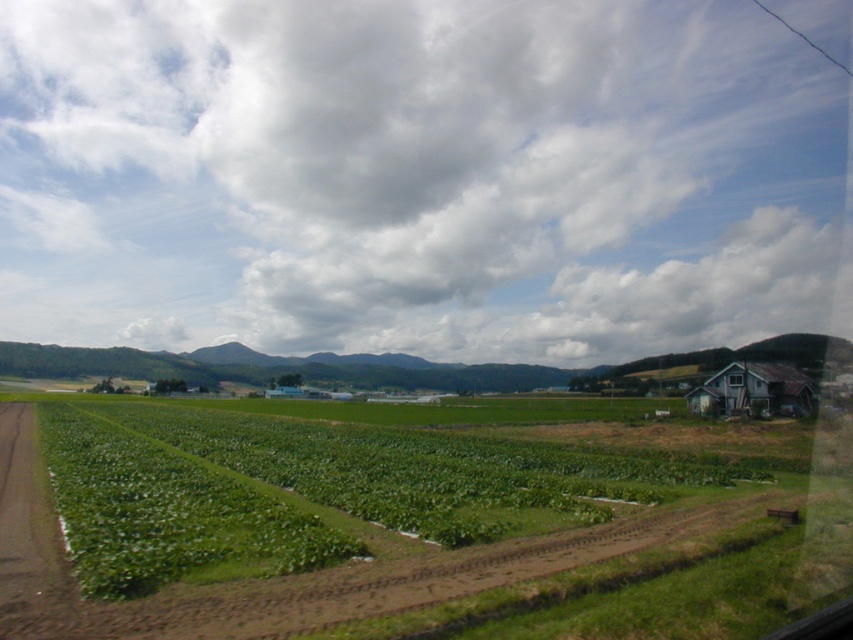
Question: Is green leafy field at center above rusty wood house at right?

Choices:
 (A) no
 (B) yes

Answer: (A)

Question: Which of the following is the closest to the observer?

Choices:
 (A) (762, 410)
 (B) (691, 83)

Answer: (A)

Question: Which object is closer to the camera taking this photo?

Choices:
 (A) green leafy field at center
 (B) cloudy sky at upper center

Answer: (A)

Question: Is the position of cloudy sky at upper center more distant than that of rusty wood house at right?

Choices:
 (A) yes
 (B) no

Answer: (A)

Question: Which object is farther from the camera taking this photo?

Choices:
 (A) green leafy field at center
 (B) cloudy sky at upper center
 (C) rusty wood house at right

Answer: (B)

Question: Can you confirm if green leafy field at center is wider than rusty wood house at right?

Choices:
 (A) yes
 (B) no

Answer: (A)